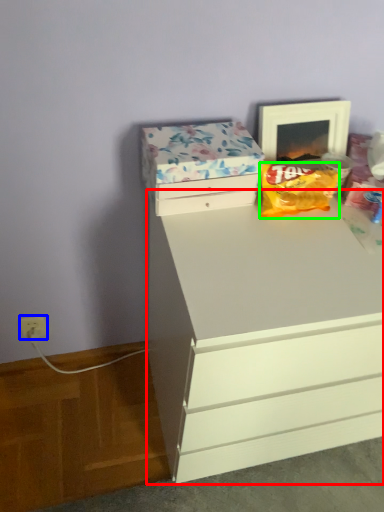
Question: Which object is positioned farthest from chest of drawers (highlighted by a red box)? Select from electric outlet (highlighted by a blue box) and snack (highlighted by a green box).

Choices:
 (A) electric outlet
 (B) snack

Answer: (A)